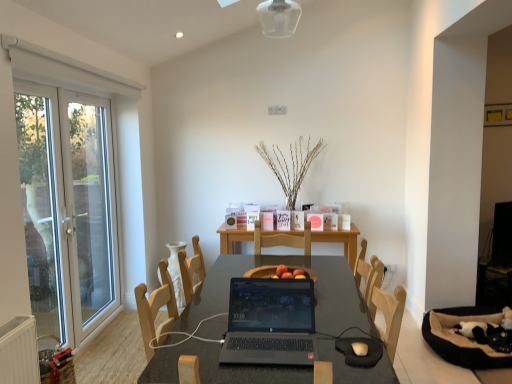
Question: Is matte white mouse at center at the right side of black matte laptop at center?

Choices:
 (A) no
 (B) yes

Answer: (B)

Question: Does matte white mouse at center lie behind black matte laptop at center?

Choices:
 (A) no
 (B) yes

Answer: (B)

Question: Can you confirm if matte white mouse at center is bigger than black matte laptop at center?

Choices:
 (A) yes
 (B) no

Answer: (B)

Question: Is matte white mouse at center not within black matte laptop at center?

Choices:
 (A) yes
 (B) no

Answer: (A)

Question: From the image's perspective, does matte white mouse at center appear higher than black matte laptop at center?

Choices:
 (A) yes
 (B) no

Answer: (B)

Question: Does matte white mouse at center have a smaller size compared to black matte laptop at center?

Choices:
 (A) yes
 (B) no

Answer: (A)

Question: Does white glass door at left appear on the right side of white glass screen door at left, which is the second screen door in back-to-front order?

Choices:
 (A) no
 (B) yes

Answer: (B)

Question: Can you confirm if white glass door at left is bigger than white glass screen door at left, the first screen door positioned from the front?

Choices:
 (A) no
 (B) yes

Answer: (B)

Question: Does white glass door at left have a greater width compared to white glass screen door at left, which is the second screen door in back-to-front order?

Choices:
 (A) yes
 (B) no

Answer: (B)

Question: Could white glass screen door at left, the first screen door positioned from the front, be considered to be inside white glass door at left?

Choices:
 (A) yes
 (B) no

Answer: (A)

Question: Is there a large distance between white glass door at left and white glass screen door at left, the first screen door positioned from the front?

Choices:
 (A) no
 (B) yes

Answer: (A)

Question: Considering the relative sizes of white glass door at left and white glass screen door at left, which is the second screen door in back-to-front order, in the image provided, is white glass door at left thinner than white glass screen door at left, which is the second screen door in back-to-front order,?

Choices:
 (A) no
 (B) yes

Answer: (B)

Question: Is matte white mouse at center positioned in front of white glass screen door at left, which is the second screen door in back-to-front order?

Choices:
 (A) no
 (B) yes

Answer: (B)